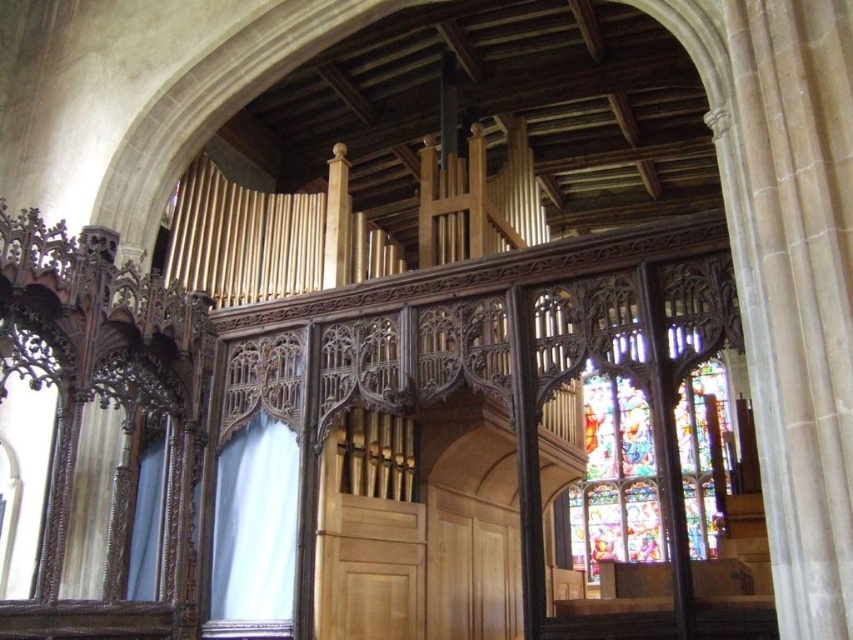
How distant is stained glass at center from transparent glass at center?

stained glass at center is 38.07 meters from transparent glass at center.

Consider the image. Does stained glass at center appear under transparent glass at center?

Yes, stained glass at center is below transparent glass at center.

Does point (723, 484) lie in front of point (239, 531)?

No, it is not.

This screenshot has width=853, height=640. Find the location of `stained glass at center`. stained glass at center is located at coordinates (614, 481).